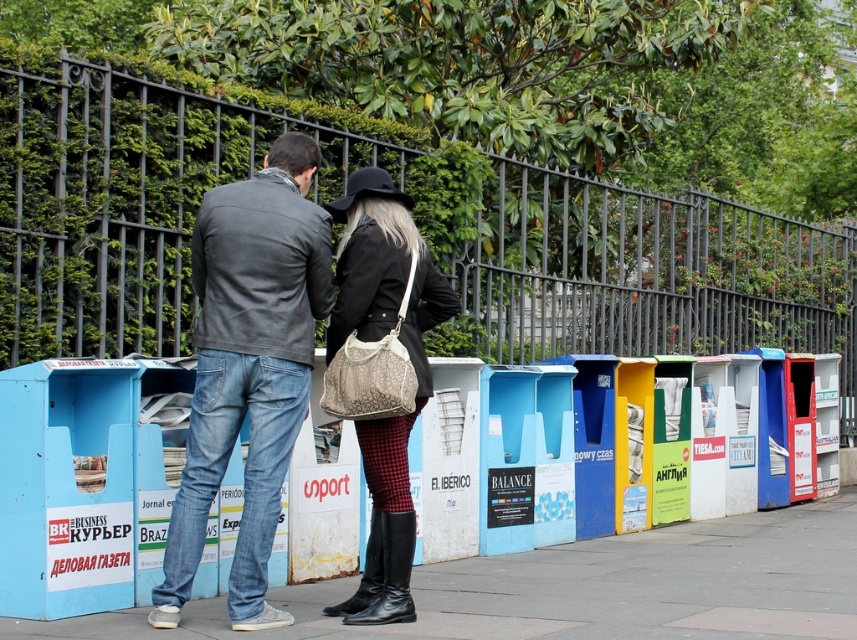
Question: Which point is closer to the camera?

Choices:
 (A) smooth concrete pavement at center
 (B) black metal fence at upper center

Answer: (B)

Question: Among these objects, which one is farthest from the camera?

Choices:
 (A) smooth concrete pavement at center
 (B) denim jeans at center
 (C) matte black coat at center

Answer: (A)

Question: Does denim jeans at center have a larger size compared to matte black coat at center?

Choices:
 (A) yes
 (B) no

Answer: (A)

Question: Does black metal fence at upper center have a smaller size compared to smooth concrete pavement at center?

Choices:
 (A) no
 (B) yes

Answer: (A)

Question: Which object is farther from the camera taking this photo?

Choices:
 (A) black metal fence at upper center
 (B) matte black coat at center
 (C) denim jeans at center

Answer: (A)

Question: Observing the image, what is the correct spatial positioning of black metal fence at upper center in reference to denim jeans at center?

Choices:
 (A) below
 (B) above

Answer: (B)